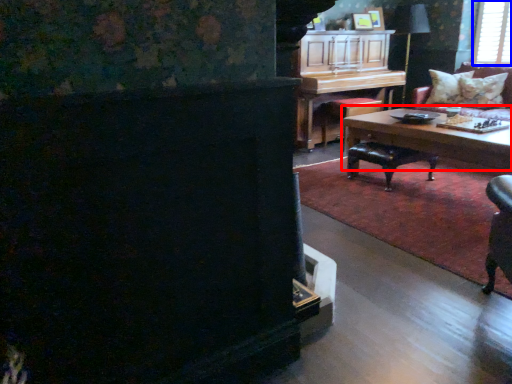
Question: Which object is closer to the camera taking this photo, coffee table (highlighted by a red box) or window screen (highlighted by a blue box)?

Choices:
 (A) coffee table
 (B) window screen

Answer: (A)